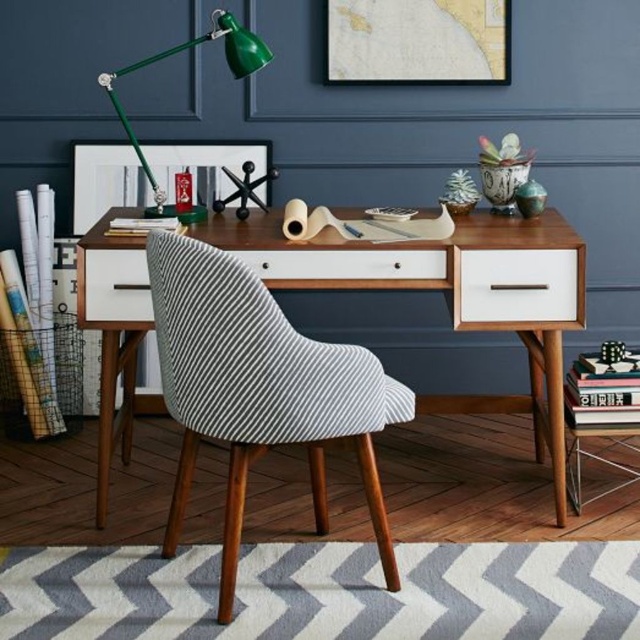
Question: Is map paper at upper center smaller than matte black picture frame at upper center?

Choices:
 (A) yes
 (B) no

Answer: (A)

Question: Among these objects, which one is nearest to the camera?

Choices:
 (A) white matte drawer at left
 (B) white matte drawer at center

Answer: (A)

Question: Is map paper at upper center above green matte desk lamp at upper left?

Choices:
 (A) no
 (B) yes

Answer: (B)

Question: Considering the real-world distances, which object is closest to the map paper at upper center?

Choices:
 (A) white matte drawer at right
 (B) green matte desk lamp at upper left
 (C) white striped fabric chair at center
 (D) matte black picture frame at upper center

Answer: (D)

Question: Does white matte drawer at right lie in front of green matte desk lamp at upper left?

Choices:
 (A) yes
 (B) no

Answer: (A)

Question: Which of the following is the closest to the observer?

Choices:
 (A) white matte drawer at right
 (B) white matte drawer at left
 (C) map paper at upper center
 (D) matte black picture frame at upper center

Answer: (B)